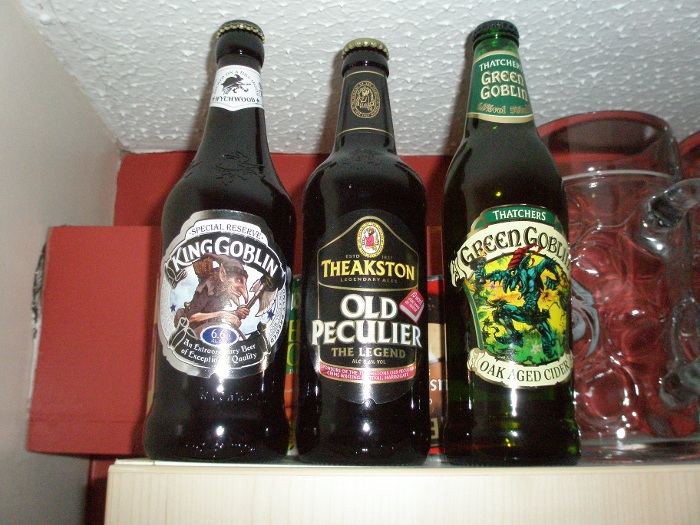
This screenshot has width=700, height=525. In order to click on glass in this screenshot , I will do point(215,341), point(348,391), point(505,370), point(649,326).